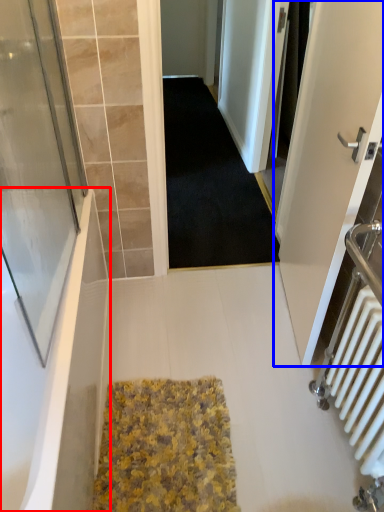
Question: Which point is further to the camera, bathtub (highlighted by a red box) or door (highlighted by a blue box)?

Choices:
 (A) bathtub
 (B) door

Answer: (B)